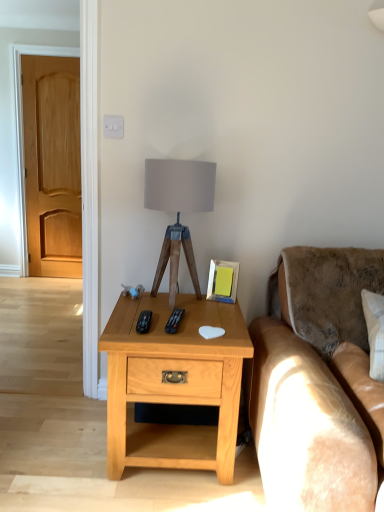
I want to click on free space to the left of black plastic remote at center, the 1th remote viewed from the left, so click(121, 323).